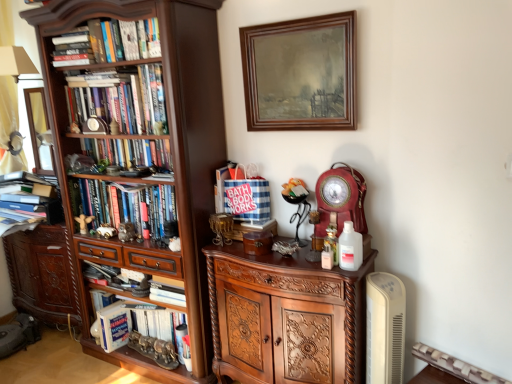
Question: From a real-world perspective, is matte red clock at center-right above or below hardcover books at center, the 1th book viewed from the top?

Choices:
 (A) below
 (B) above

Answer: (A)

Question: From the image's perspective, is matte red clock at center-right above or below hardcover books at center, arranged as the 5th book when ordered from the bottom?

Choices:
 (A) above
 (B) below

Answer: (B)

Question: Which object is positioned closest to the hardcover books at left, the 4th book from the bottom?

Choices:
 (A) polished wood cabinet at center, the 2th cabinetry from the back
 (B) hardcover book at lower left, the 5th book from the top
 (C) brown carved cabinet at lower left, marked as the first cabinetry in a left-to-right arrangement
 (D) hardcover book at lower left
 (E) hardcover books at center, the 1th book viewed from the top

Answer: (E)

Question: Which object is the farthest from the hardcover books at center, the 1th book viewed from the top?

Choices:
 (A) polished wood cabinet at center, acting as the 1th cabinetry starting from the front
 (B) dark wood bookcase at left
 (C) hardcover book at left, the 4th book from the top
 (D) hardcover books at left, the 4th book from the bottom
 (E) brown carved cabinet at lower left, marked as the first cabinetry in a left-to-right arrangement

Answer: (A)